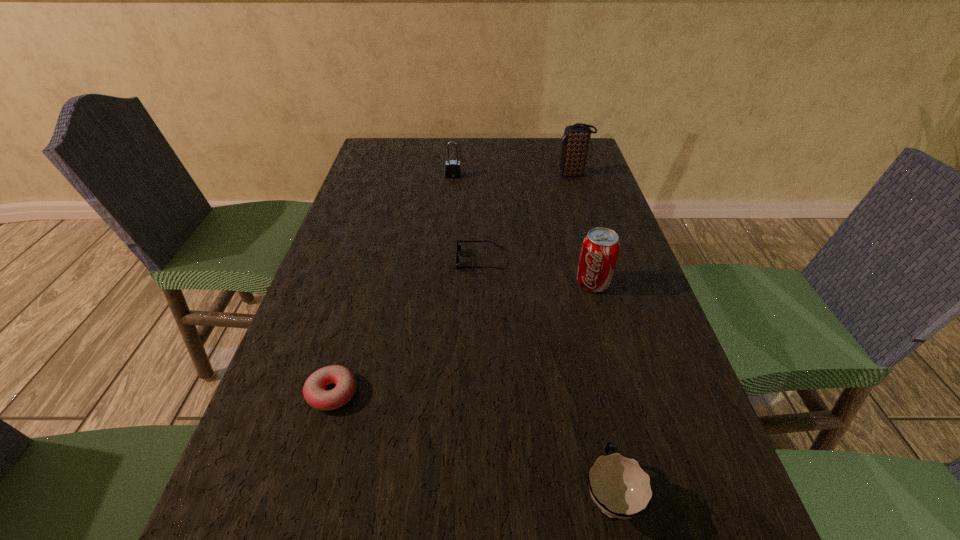
Locate an element on the screen. The height and width of the screenshot is (540, 960). free spot between the soda and the third shortest object is located at coordinates (601, 389).

Image resolution: width=960 pixels, height=540 pixels. I want to click on the fifth closest object to the doughnut, so click(x=576, y=138).

Identify which object is located as the third nearest to the leftmost object. Please provide its 2D coordinates. Your answer should be formatted as a tuple, i.e. [(x, y)], where the tuple contains the x and y coordinates of a point satisfying the conditions above.

[(600, 249)]

Where is `vacant area that satisfies the following two spatial constraints: 1. on the shackle of the padlock; 2. on the left side of the soda`? vacant area that satisfies the following two spatial constraints: 1. on the shackle of the padlock; 2. on the left side of the soda is located at coordinates (444, 283).

Find the location of a particular element. free location that satisfies the following two spatial constraints: 1. on the front-facing side of the sunglasses; 2. on the front side of the fifth farthest object is located at coordinates (481, 393).

Where is `vacant space that satisfies the following two spatial constraints: 1. on the side of the third shortest object with the handle; 2. on the front-facing side of the sunglasses`? This screenshot has width=960, height=540. vacant space that satisfies the following two spatial constraints: 1. on the side of the third shortest object with the handle; 2. on the front-facing side of the sunglasses is located at coordinates (560, 260).

Locate an element on the screen. Image resolution: width=960 pixels, height=540 pixels. free space that satisfies the following two spatial constraints: 1. on the shackle of the soda; 2. on the left side of the third tallest object is located at coordinates (444, 283).

The width and height of the screenshot is (960, 540). What are the coordinates of `vacant space that satisfies the following two spatial constraints: 1. on the back side of the doughnut; 2. on the left side of the soda` in the screenshot? It's located at (364, 283).